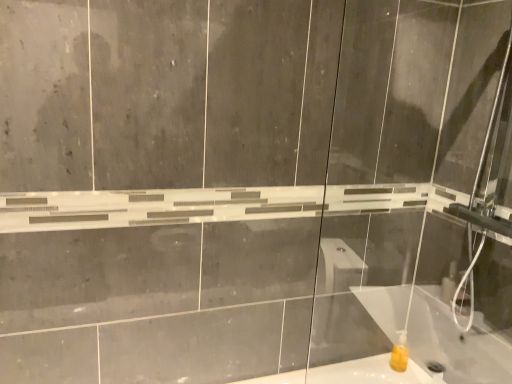
Question: Should I look upward or downward to see transparent glass shower door at right?

Choices:
 (A) down
 (B) up

Answer: (B)